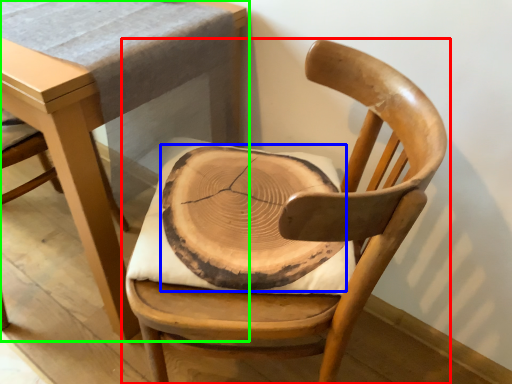
Question: Estimate the real-world distances between objects in this image. Which object is closer to chair (highlighted by a red box), pad (highlighted by a blue box) or table (highlighted by a green box)?

Choices:
 (A) pad
 (B) table

Answer: (A)